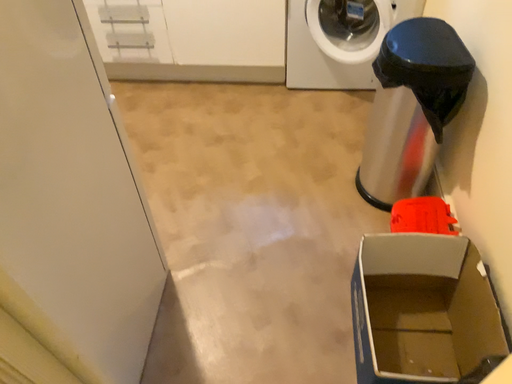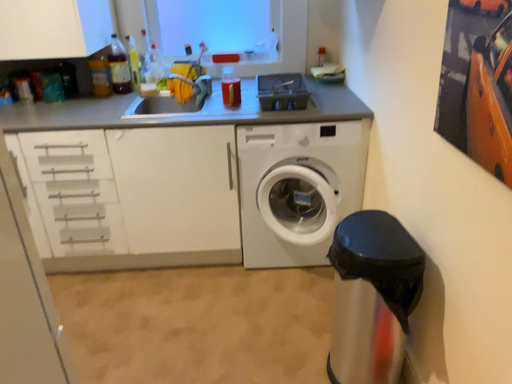
Question: Which way did the camera rotate in the video?

Choices:
 (A) rotated downward
 (B) rotated upward

Answer: (B)